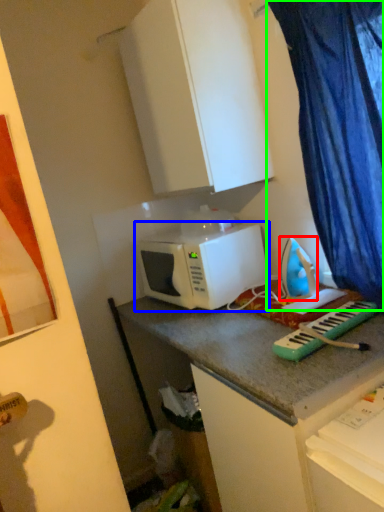
Question: Which object is the farthest from appliance (highlighted by a red box)? Choose among these: microwave oven (highlighted by a blue box) or curtain (highlighted by a green box).

Choices:
 (A) microwave oven
 (B) curtain

Answer: (B)